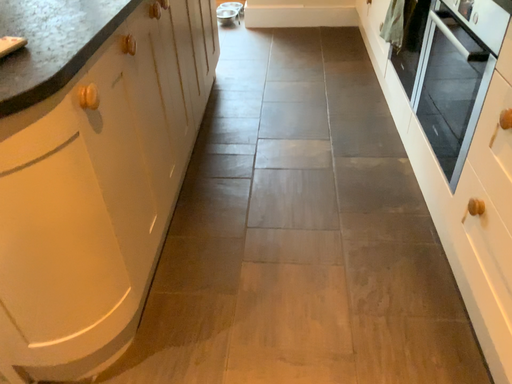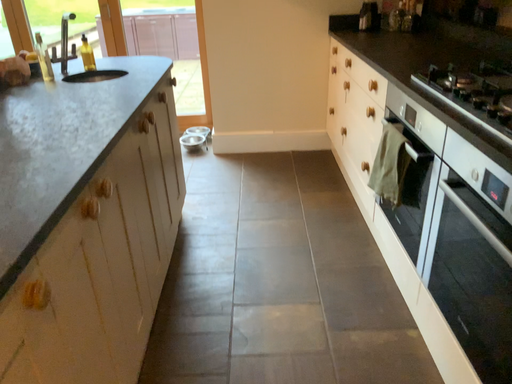
Question: Which way did the camera rotate in the video?

Choices:
 (A) rotated upward
 (B) rotated downward

Answer: (A)